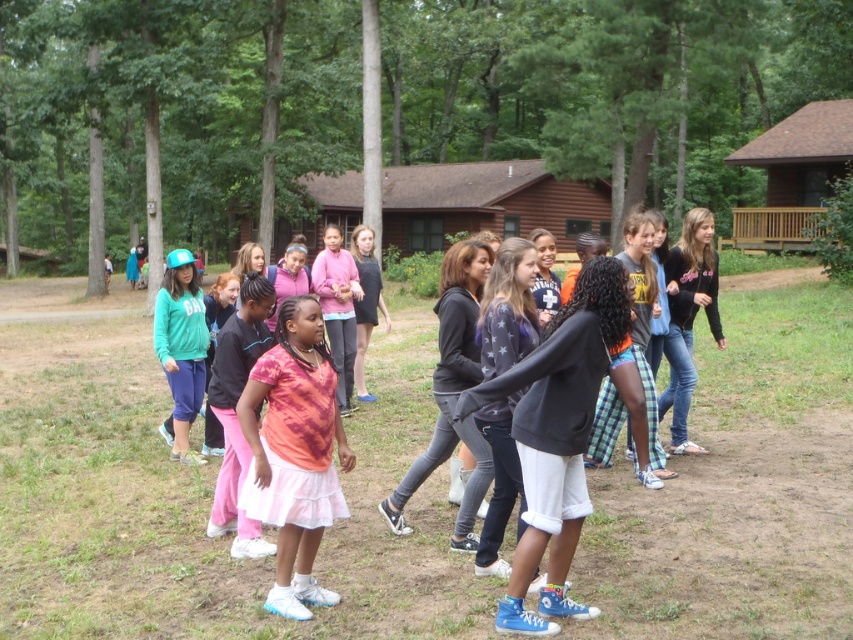
Which of these two, tie-dye fabric shirt at center or brown wooden cabin at center, stands shorter?

Standing shorter between the two is tie-dye fabric shirt at center.

Is tie-dye fabric shirt at center above brown wooden cabin at center?

No.

Identify the location of tie-dye fabric shirt at center. 294,452.

Is brown wooden cabin at upper right further to camera compared to pink fabric skirt at center?

Yes.

Who is more forward, (x=822, y=145) or (x=227, y=381)?

Point (x=227, y=381)

Which is in front, point (804, 125) or point (222, 388)?

Point (222, 388) is more forward.

Identify the location of brown wooden cabin at upper right. The height and width of the screenshot is (640, 853). (793, 173).

Is black cotton sweatshirt at center bigger than tie-dye fabric shirt at center?

Yes, black cotton sweatshirt at center is bigger than tie-dye fabric shirt at center.

Describe the element at coordinates (558, 435) in the screenshot. This screenshot has width=853, height=640. I see `black cotton sweatshirt at center` at that location.

Between point (602, 376) and point (303, 554), which one is positioned behind?

The point (303, 554) is more distant.

Where is `black cotton sweatshirt at center`? black cotton sweatshirt at center is located at coordinates (558, 435).